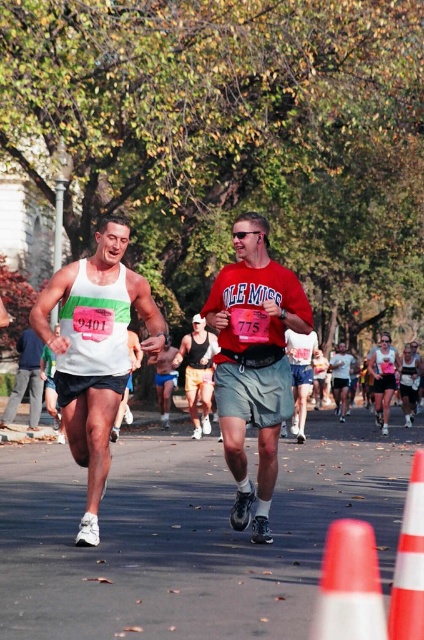
You are a spectator at the marathon and want to take a photo of both runners. The red matte shirt at center and the white matte tank top at left are positioned in the frame. Which runner is closer to the right edge of your camera view?

The red matte shirt at center is to the right of the white matte tank top at left, so the runner with the red matte shirt at center is closer to the right edge of the camera view.

You are a photographer standing at the starting line of the marathon. You want to take a photo that includes both the red matte shirt at center and the white matte tank top at left. Considering their heights, which runner should you position closer to the camera to ensure both are fully visible in the frame?

The red matte shirt at center is much taller than the white matte tank top at left. To ensure both are fully visible, position the shorter white matte tank top at left closer to the camera so that the taller runner doesn